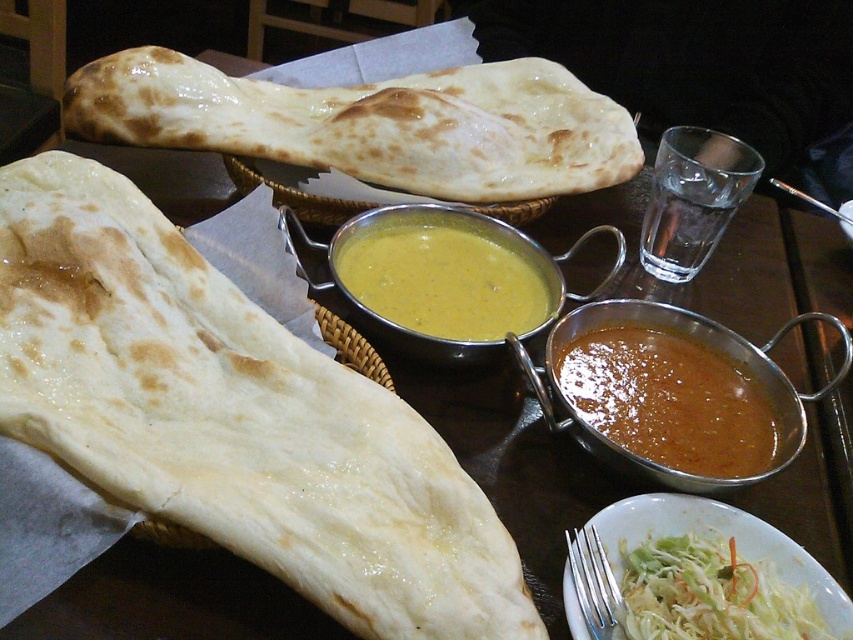
Is brown matte curry at center wider than yellow creamy soup at center?

No, brown matte curry at center is not wider than yellow creamy soup at center.

Between brown matte curry at center and yellow creamy soup at center, which one appears on the left side from the viewer's perspective?

From the viewer's perspective, yellow creamy soup at center appears more on the left side.

Image resolution: width=853 pixels, height=640 pixels. What are the coordinates of `brown matte curry at center` in the screenshot? It's located at (669, 401).

Where is `brown matte curry at center`? brown matte curry at center is located at coordinates (669, 401).

Does brown matte curry at center have a larger size compared to shredded white cabbage at lower right?

Yes.

Who is more distant from viewer, (x=695, y=342) or (x=672, y=596)?

The point (x=695, y=342) is more distant.

Describe the element at coordinates (669, 401) in the screenshot. I see `brown matte curry at center` at that location.

The image size is (853, 640). I want to click on brown matte curry at center, so click(x=669, y=401).

Which is behind, point (167, 419) or point (622, 556)?

Positioned behind is point (622, 556).

Is white matte naan at left smaller than shredded white cabbage at lower right?

Actually, white matte naan at left might be larger than shredded white cabbage at lower right.

Where is `white matte naan at left`? white matte naan at left is located at coordinates [233, 417].

Identify the location of white matte naan at left. The image size is (853, 640). click(233, 417).